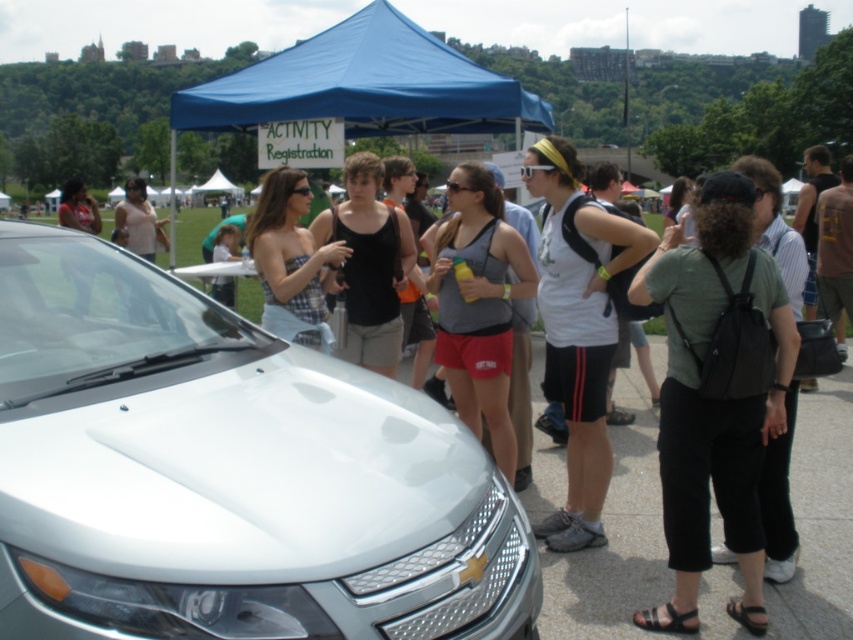
Question: Can you confirm if gray matte tank top at center is positioned above plaid fabric dress at center?

Choices:
 (A) yes
 (B) no

Answer: (B)

Question: Can you confirm if green fabric backpack at right is thinner than black matte tank top at center?

Choices:
 (A) no
 (B) yes

Answer: (A)

Question: Among these points, which one is farthest from the camera?

Choices:
 (A) (283, 280)
 (B) (714, 179)
 (C) (326, 81)
 (D) (379, 241)

Answer: (C)

Question: Which point appears closest to the camera in this image?

Choices:
 (A) (283, 56)
 (B) (283, 337)
 (C) (670, 397)
 (D) (508, 394)

Answer: (C)

Question: Is white glossy car at center bigger than plaid fabric dress at center?

Choices:
 (A) yes
 (B) no

Answer: (A)

Question: Which of the following is the farthest from the observer?

Choices:
 (A) white matte tank top at center
 (B) white glossy car at center
 (C) gray matte tank top at center

Answer: (C)